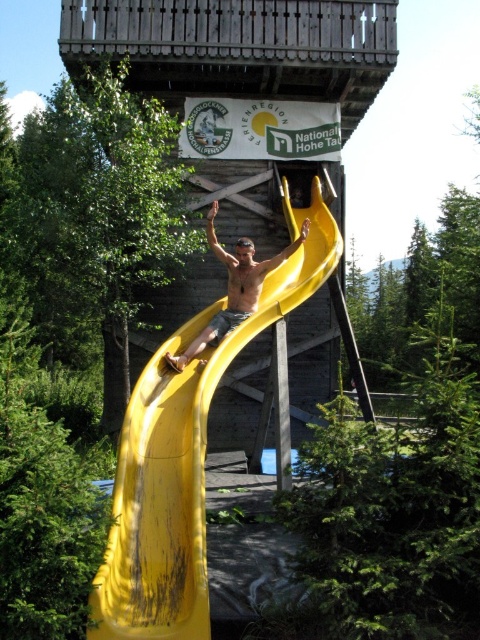
Question: Can you confirm if yellow rubber slide at center is positioned to the right of wooden at center?

Choices:
 (A) yes
 (B) no

Answer: (A)

Question: Which point is closer to the camera taking this photo?

Choices:
 (A) (248, 244)
 (B) (122, 1)

Answer: (A)

Question: Which of these objects is positioned farthest from the yellow rubber slide at center?

Choices:
 (A) matte yellow slide at center
 (B) wooden at center

Answer: (B)

Question: Does wooden at center appear under matte yellow slide at center?

Choices:
 (A) yes
 (B) no

Answer: (B)

Question: Which of the following is the farthest from the observer?

Choices:
 (A) (151, 582)
 (B) (242, 268)
 (C) (84, 29)

Answer: (C)

Question: Considering the relative positions of yellow rubber slide at center and matte yellow slide at center in the image provided, where is yellow rubber slide at center located with respect to matte yellow slide at center?

Choices:
 (A) below
 (B) above

Answer: (A)